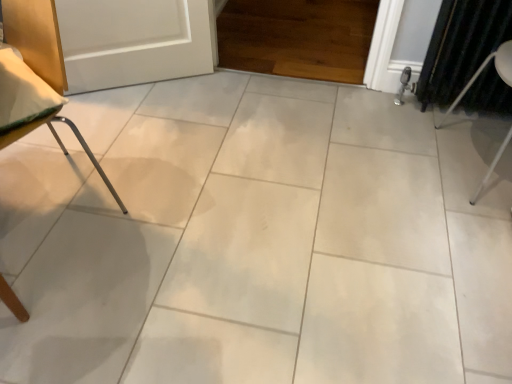
This screenshot has width=512, height=384. Find the location of `vacant area that lies between metallic silver chair leg at left, marked as the 1th furniture in a left-to-right arrangement, and dark green fabric curtain at right`. vacant area that lies between metallic silver chair leg at left, marked as the 1th furniture in a left-to-right arrangement, and dark green fabric curtain at right is located at coordinates (236, 167).